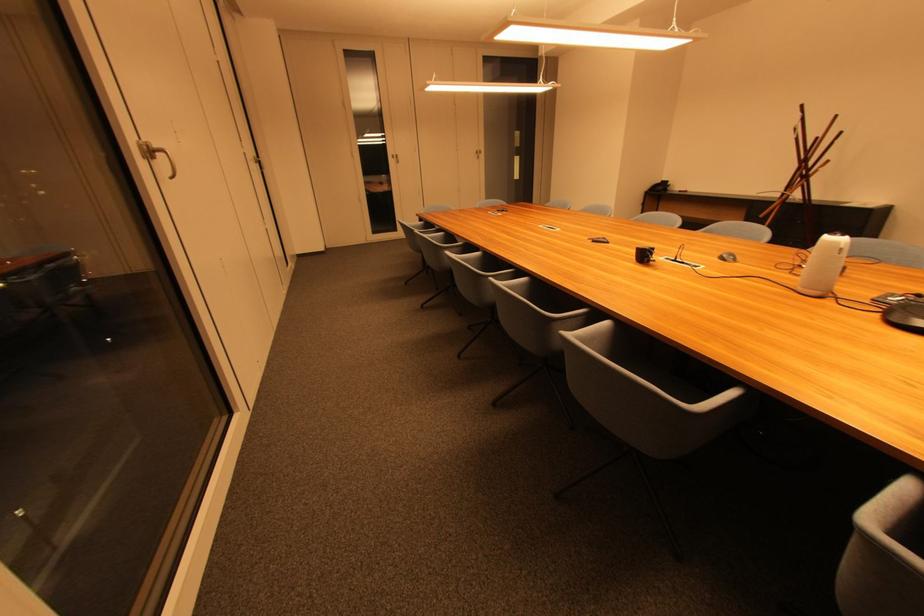
Locate an element on the screen. This screenshot has width=924, height=616. grey computer mouse is located at coordinates (726, 257).